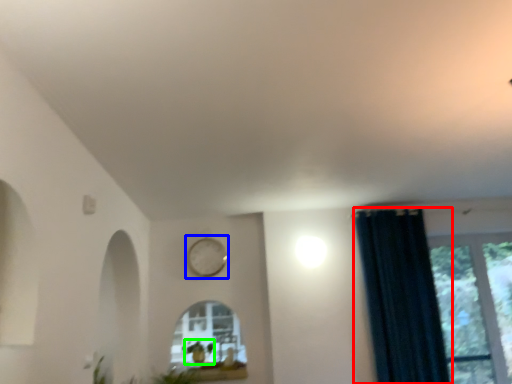
Question: Considering the real-world distances, which object is closest to curtain (highlighted by a red box)? clock (highlighted by a blue box) or plant (highlighted by a green box).

Choices:
 (A) clock
 (B) plant

Answer: (A)